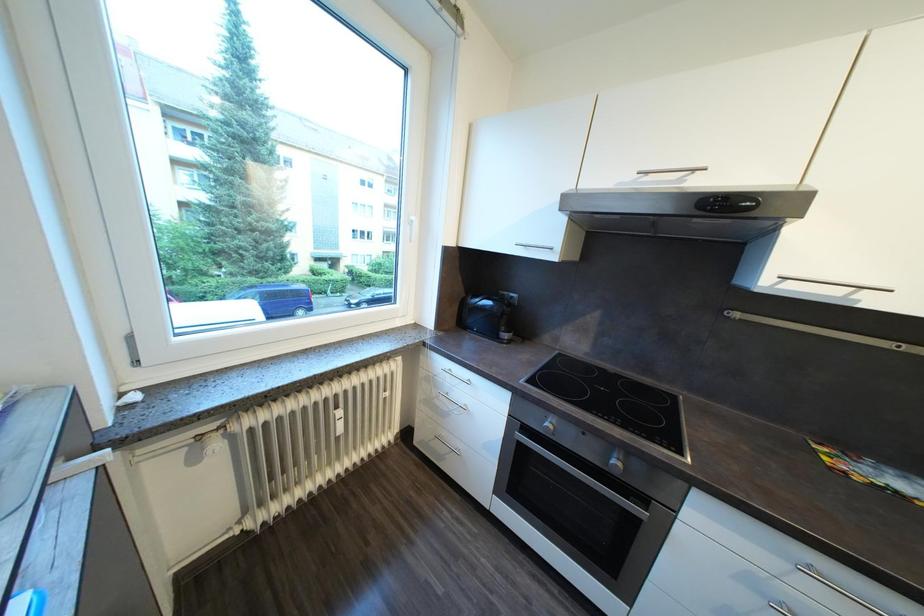
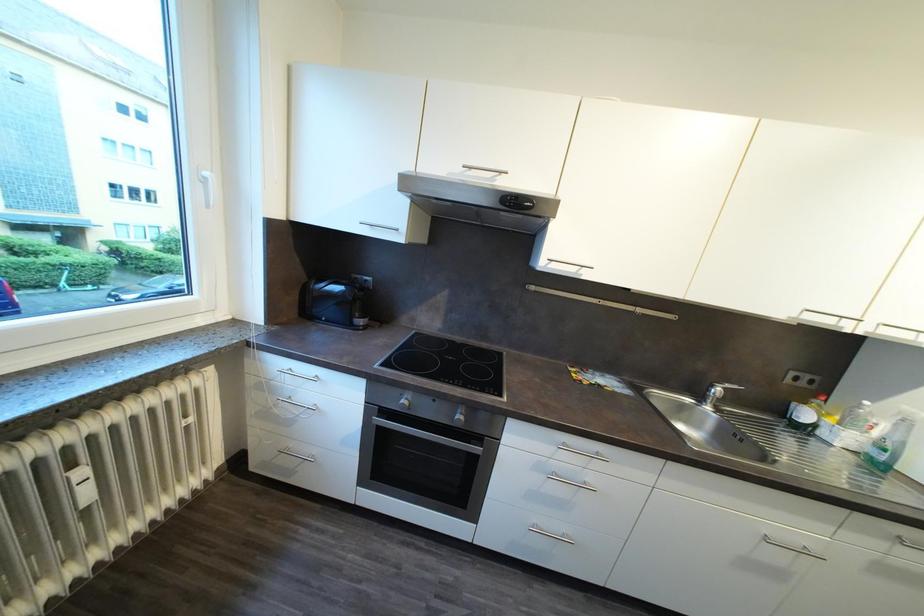
Question: Which direction would the cameraman need to move to produce the second image? Reply with the corresponding letter.

Choices:
 (A) Left
 (B) Right
 (C) Forward
 (D) Backward

Answer: (B)